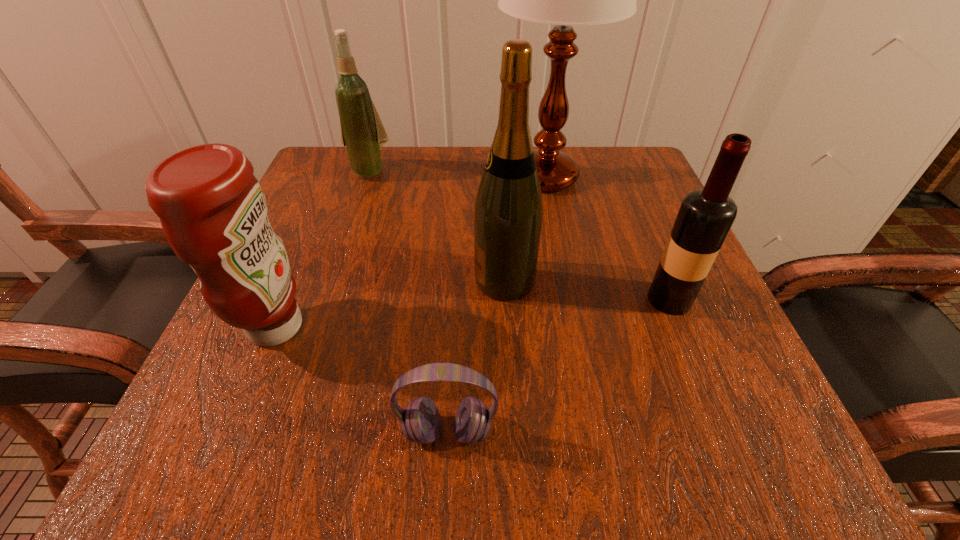
Where is `table lamp that is at the right edge`? The image size is (960, 540). table lamp that is at the right edge is located at coordinates (565, 0).

The width and height of the screenshot is (960, 540). I want to click on wine bottle at the right edge, so click(705, 217).

Where is `object positioned at the far left corner`? This screenshot has width=960, height=540. object positioned at the far left corner is located at coordinates pyautogui.click(x=362, y=132).

The image size is (960, 540). I want to click on object at the far right corner, so click(x=565, y=0).

Identify the location of blank space at the far edge. (426, 168).

In the image, there is a desktop. In order to click on vacant space at the near edge in this screenshot , I will do `click(366, 444)`.

Identify the location of vacant position at the right edge of the desktop. The height and width of the screenshot is (540, 960). (646, 321).

Where is `blank space at the far left corner of the desktop`? The width and height of the screenshot is (960, 540). blank space at the far left corner of the desktop is located at coordinates (346, 199).

Where is `free space at the far right corner of the desktop`? Image resolution: width=960 pixels, height=540 pixels. free space at the far right corner of the desktop is located at coordinates (651, 191).

I want to click on free space between the headset and the tallest object, so (x=496, y=305).